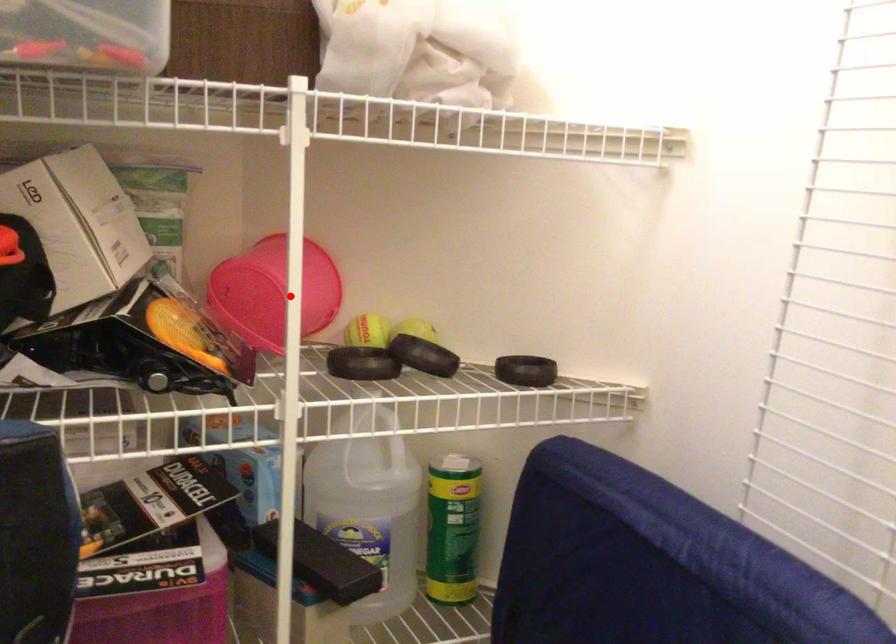
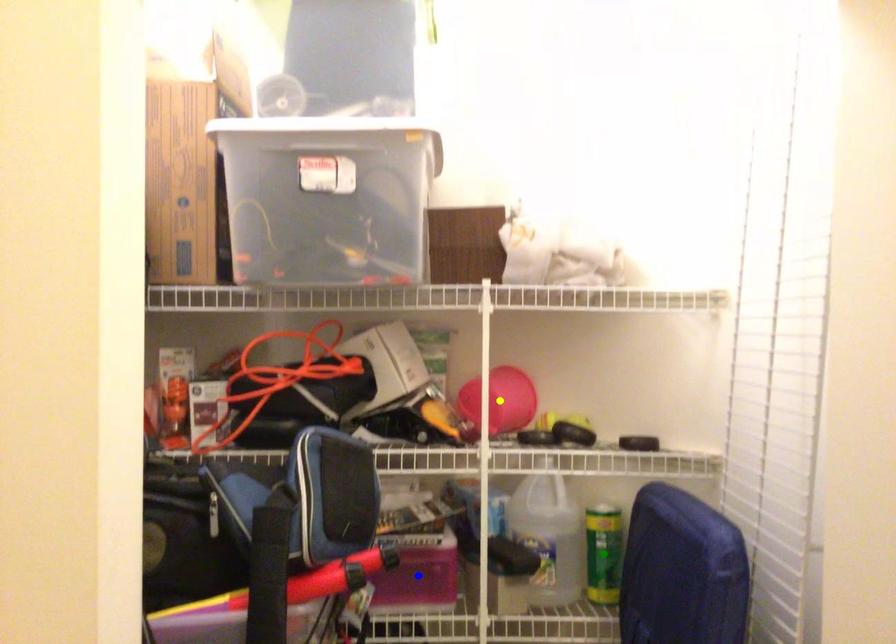
Question: I am providing you with two images of the same scene from different viewpoints. A red point is marked on the first image. You are given multiple points on the second image. In image 2, which mark is for the same physical point as the one in image 1?

Choices:
 (A) green point
 (B) blue point
 (C) yellow point

Answer: (C)